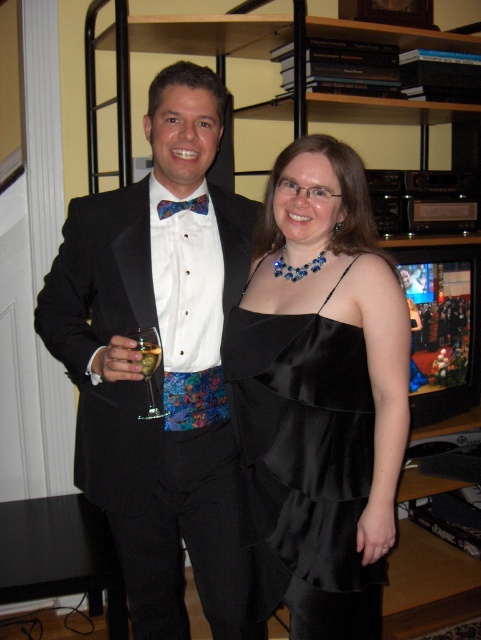
You are a bartender preparing drinks for a party. You have a translucent glass wine at center and a multicolored fabric bow tie at center on the counter. Which item is smaller in size?

The translucent glass wine at center is smaller in size compared to the multicolored fabric bow tie at center.

You are a photographer trying to capture a closeup of the matte black tuxedo at left. What coordinate should you focus on?

The matte black tuxedo at left is located at coordinate point (x=162, y=362), so focus there.